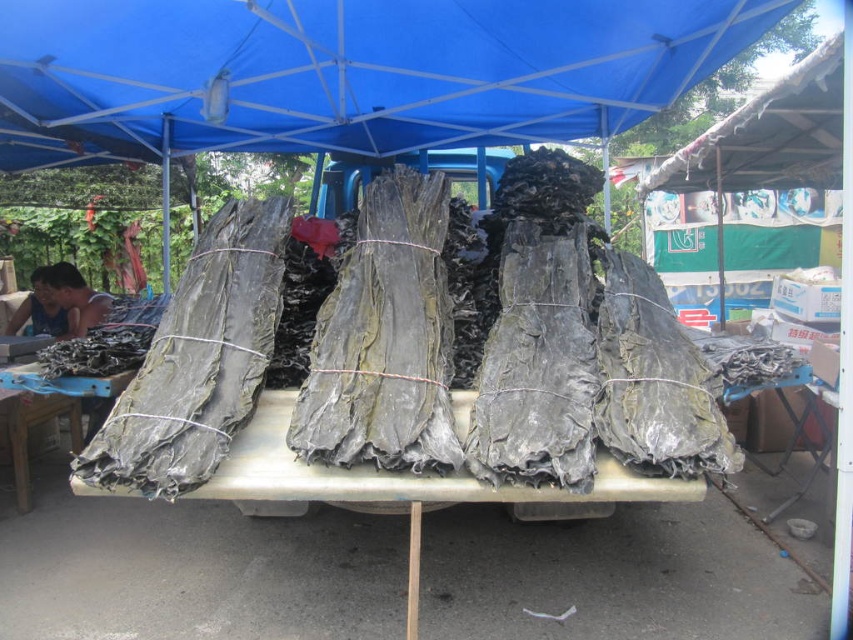
You are a customer at the outdoor market and want to find the blue fabric vendor at left. According to the scene, where should you look relative to the blue fabric canopy at upper center?

The blue fabric canopy at upper center is positioned over the blue fabric vendor at left, so you should look directly below the blue fabric canopy at upper center to find the blue fabric vendor at left.

You are standing at the market entrance and notice the blue fabric canopy at upper center and the blue fabric vendor at left. Which of these two items is wider?

The blue fabric canopy at upper center is wider than the blue fabric vendor at left according to the description.

You are setting up a display at the market and want to place the green leafy bundles at center on top of the rough wooden table at lower left. Based on their sizes, will the bundles fit on the table without hanging over the edges?

The green leafy bundles at center is shorter than the rough wooden table at lower left, so the bundles will fit on the table without hanging over the edges since the table is taller than the bundles.